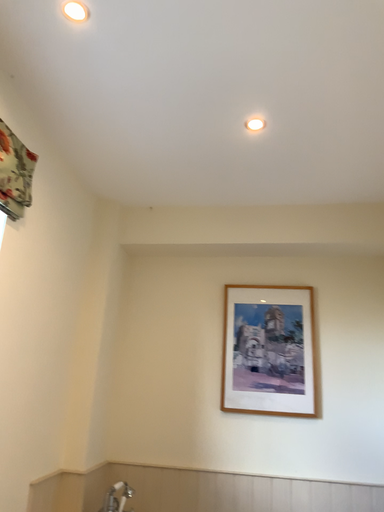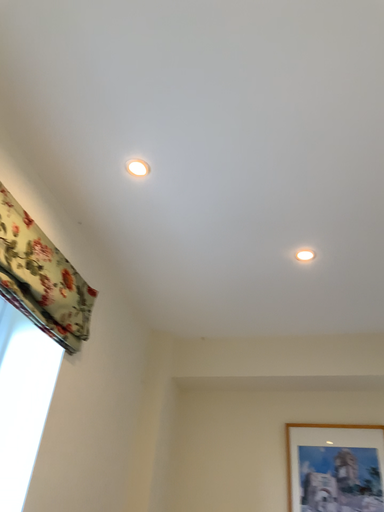
Question: Which way did the camera rotate in the video?

Choices:
 (A) rotated right
 (B) rotated left

Answer: (B)